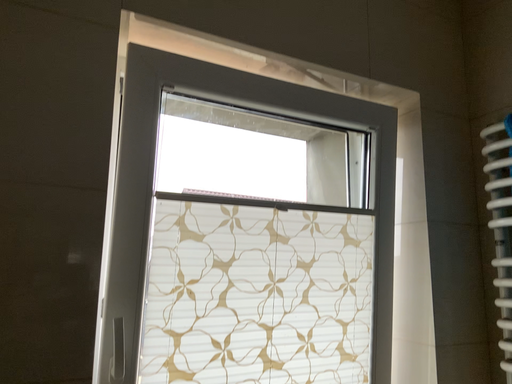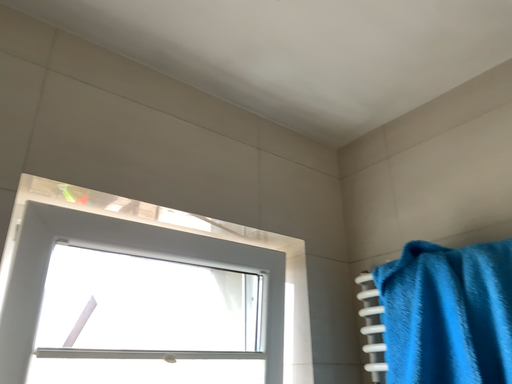
Question: Which way did the camera rotate in the video?

Choices:
 (A) rotated left
 (B) rotated right

Answer: (B)